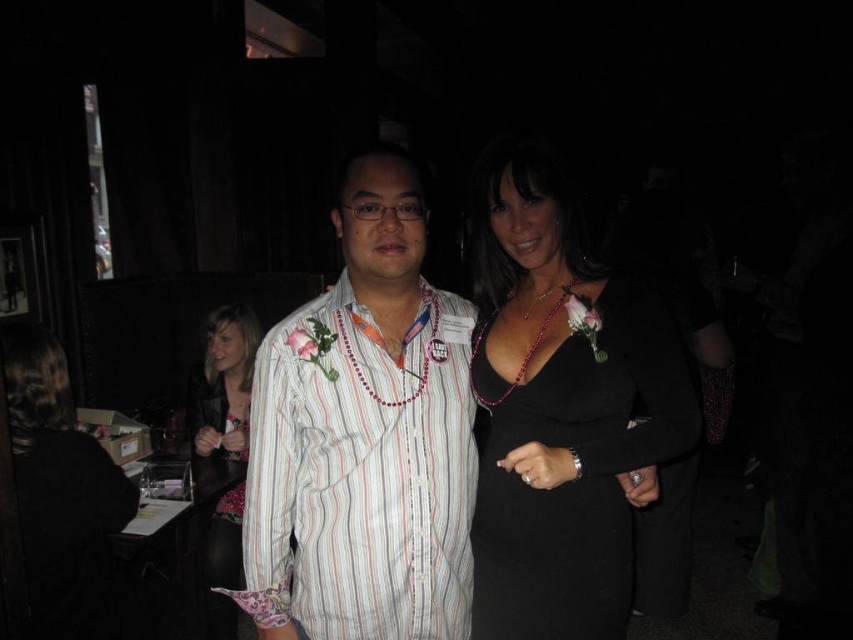
Question: Among these objects, which one is farthest from the camera?

Choices:
 (A) striped cotton shirt at center
 (B) black satin dress at right
 (C) black leather ring at center
 (D) black satin dress at lower left

Answer: (D)

Question: Which of the following is the closest to the observer?

Choices:
 (A) (489, 611)
 (B) (225, 548)
 (C) (590, 524)
 (D) (556, 484)

Answer: (D)

Question: Is black satin dress at center wider than white striped shirt at center?

Choices:
 (A) no
 (B) yes

Answer: (A)

Question: Does striped cotton shirt at center have a larger size compared to floral dress at center?

Choices:
 (A) yes
 (B) no

Answer: (A)

Question: Which of the following is the farthest from the observer?

Choices:
 (A) (317, 307)
 (B) (624, 520)
 (C) (694, 436)
 (D) (524, 444)

Answer: (B)

Question: Is black satin dress at right smaller than black satin dress at lower left?

Choices:
 (A) yes
 (B) no

Answer: (A)